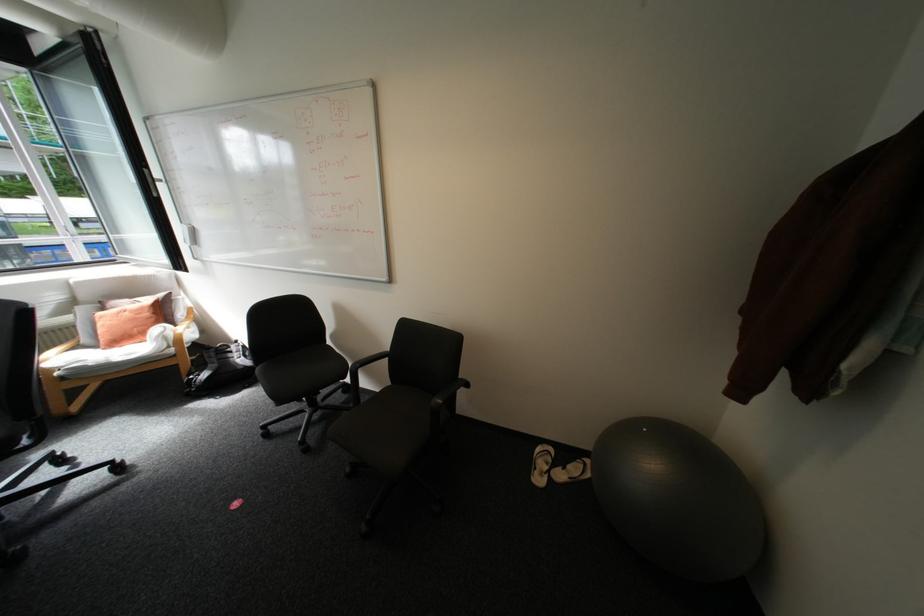
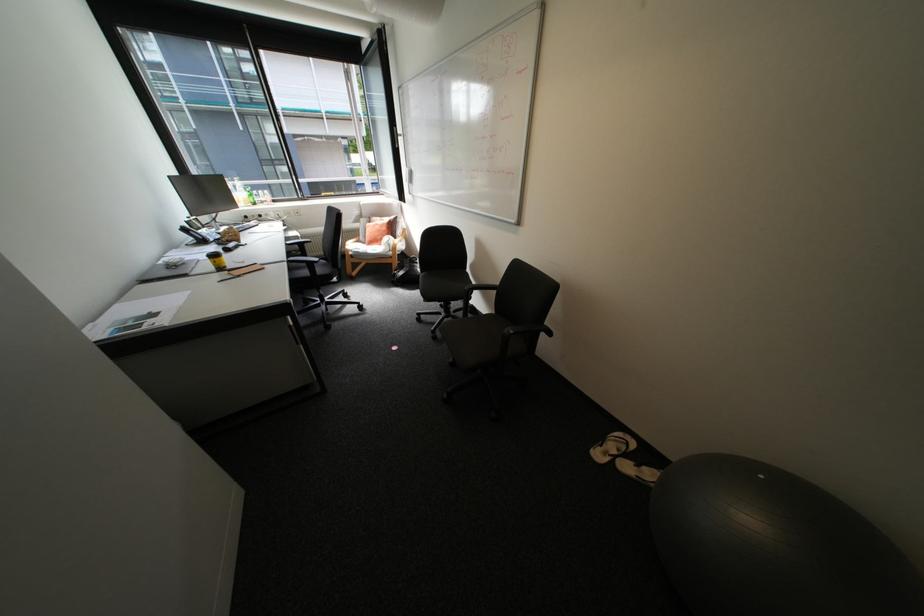
Locate, in the second image, the point that corresponds to pixel 287 406 in the first image.

(434, 302)